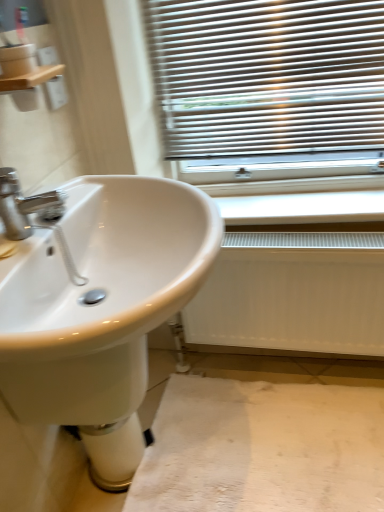
I want to click on free spot above white plastic radiator at lower center (from a real-world perspective), so click(292, 203).